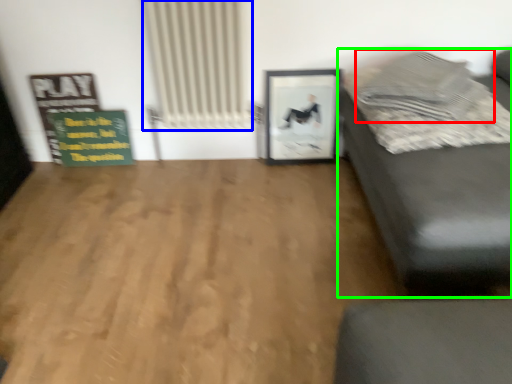
Question: Which is farther away from pillow (highlighted by a red box)? radiator (highlighted by a blue box) or studio couch (highlighted by a green box)?

Choices:
 (A) radiator
 (B) studio couch

Answer: (A)